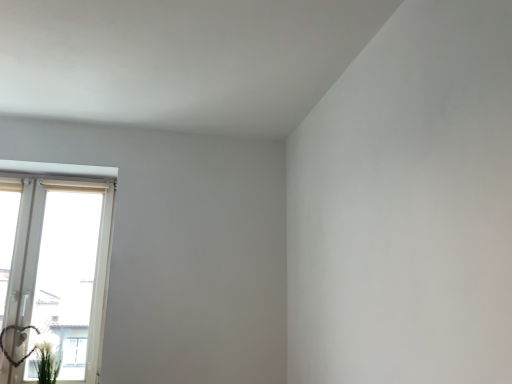
Question: Is the depth of green leafy plant at lower left greater than that of white plastic window at left?

Choices:
 (A) yes
 (B) no

Answer: (B)

Question: Is green leafy plant at lower left closer to camera compared to white plastic window at left?

Choices:
 (A) no
 (B) yes

Answer: (B)

Question: Does green leafy plant at lower left appear on the right side of white plastic window at left?

Choices:
 (A) no
 (B) yes

Answer: (B)

Question: From a real-world perspective, is green leafy plant at lower left located higher than white plastic window at left?

Choices:
 (A) no
 (B) yes

Answer: (A)

Question: Is green leafy plant at lower left positioned beyond the bounds of white plastic window at left?

Choices:
 (A) yes
 (B) no

Answer: (A)

Question: Does green leafy plant at lower left contain white plastic window at left?

Choices:
 (A) yes
 (B) no

Answer: (B)

Question: Is the position of white plastic window at left more distant than that of green leafy plant at lower left?

Choices:
 (A) yes
 (B) no

Answer: (A)

Question: From the image's perspective, is white plastic window at left located above green leafy plant at lower left?

Choices:
 (A) yes
 (B) no

Answer: (A)

Question: Does white plastic window at left touch green leafy plant at lower left?

Choices:
 (A) yes
 (B) no

Answer: (B)

Question: Does white plastic window at left have a smaller size compared to green leafy plant at lower left?

Choices:
 (A) no
 (B) yes

Answer: (A)

Question: From the image's perspective, is white plastic window at left beneath green leafy plant at lower left?

Choices:
 (A) no
 (B) yes

Answer: (A)

Question: Is white plastic window at left far from green leafy plant at lower left?

Choices:
 (A) no
 (B) yes

Answer: (A)

Question: Is point (78, 281) positioned closer to the camera than point (56, 364)?

Choices:
 (A) closer
 (B) farther

Answer: (B)